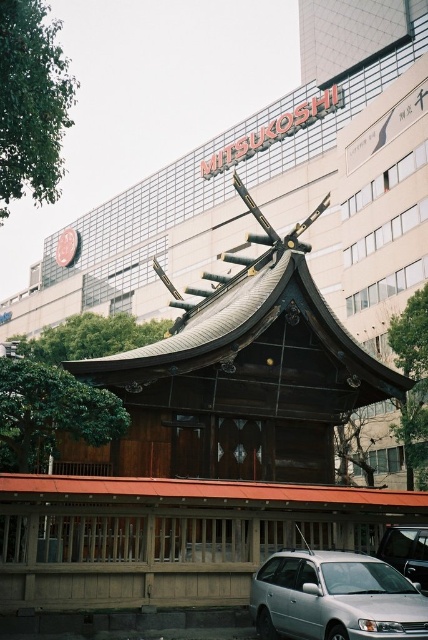
Describe the element at coordinates (335, 596) in the screenshot. This screenshot has height=640, width=428. I see `silver metallic car at lower center` at that location.

Who is shorter, silver metallic car at lower center or metallic silver car at center?

Standing shorter between the two is metallic silver car at center.

This screenshot has width=428, height=640. What do you see at coordinates (335, 596) in the screenshot?
I see `silver metallic car at lower center` at bounding box center [335, 596].

Where is `silver metallic car at lower center`? Image resolution: width=428 pixels, height=640 pixels. silver metallic car at lower center is located at coordinates (335, 596).